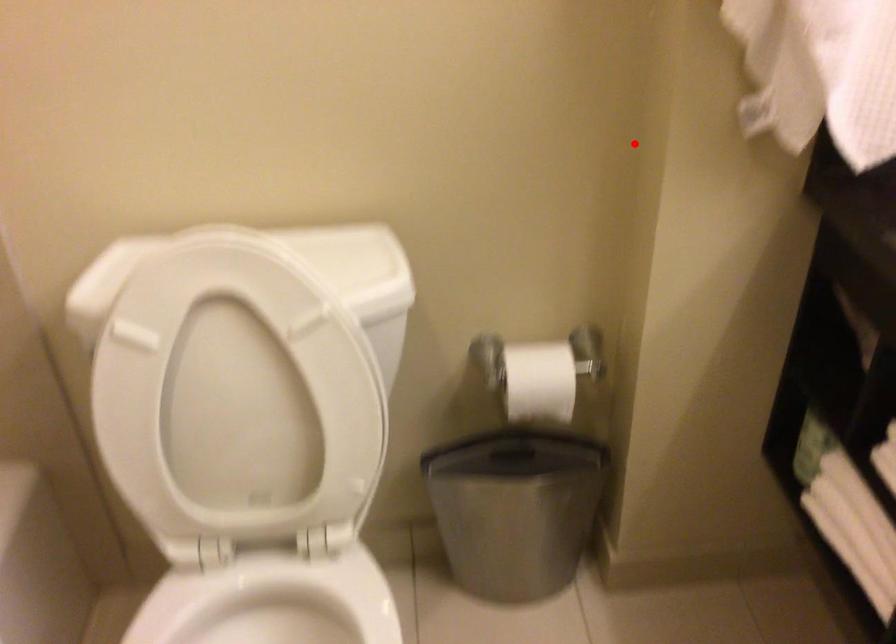
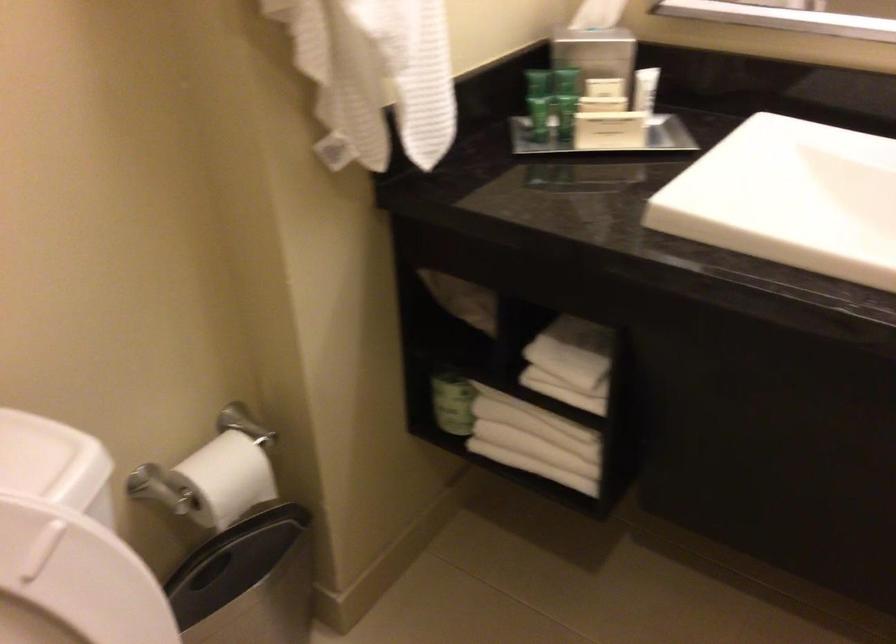
Where in the second image is the point corresponding to the highlighted location from the first image?

(218, 210)